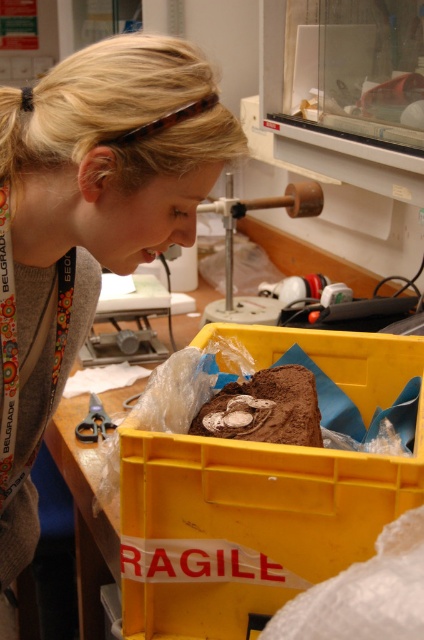
From the picture: You are a lab technician who needs to weigh an object using the brushed metal scale at center. However, you notice the blonde hair at upper left might interfere with the measurement. Can you move the hair out of the way without disturbing the scale?

The blonde hair at upper left is in front of the brushed metal scale at center, so you can carefully move the hair away from the scale to avoid interference without touching the scale itself.

You are a researcher in the lab and need to determine the distance between two points of interest. The first point is at coordinates point (304, 428) and the second point is at coordinates point (225, 300). Given that the distance between these points is 0.2 meters, can you confirm if the point closer to you is the first or second point?

Point (304, 428) is closer to the viewer than point (225, 300), so the first point is closer.

You are standing in the laboratory and want to reach the point marked at coordinates (109, 339). If your arm can extend 1.5 meters, can you reach that point without moving your feet?

The point at coordinates (109, 339) is 1.72 meters away from you. Since your arm can only extend 1.5 meters, you cannot reach it without moving your feet.